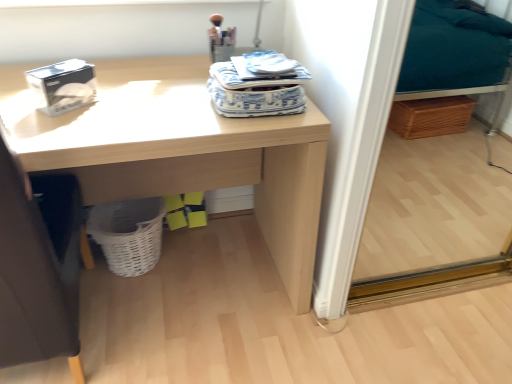
Find the location of a particular element. Image resolution: width=512 pixels, height=384 pixels. vacant space to the right of white woven basket at lower left is located at coordinates pos(198,258).